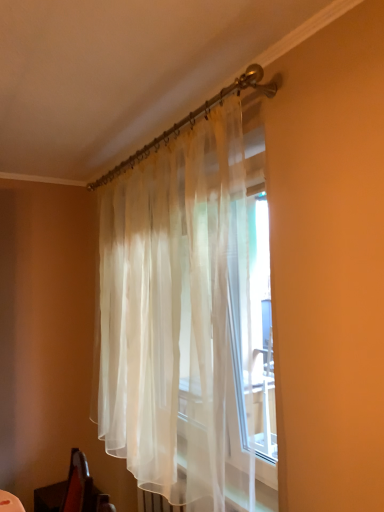
Question: From a real-world perspective, is translucent white curtain at upper center above or below wooden swivel chair at lower left?

Choices:
 (A) above
 (B) below

Answer: (A)

Question: Would you say translucent white curtain at upper center is to the left or to the right of wooden swivel chair at lower left in the picture?

Choices:
 (A) right
 (B) left

Answer: (A)

Question: From the image's perspective, is translucent white curtain at upper center above or below wooden swivel chair at lower left?

Choices:
 (A) above
 (B) below

Answer: (A)

Question: From a real-world perspective, is wooden swivel chair at lower left positioned above or below translucent white curtain at upper center?

Choices:
 (A) below
 (B) above

Answer: (A)

Question: Is wooden swivel chair at lower left in front of or behind translucent white curtain at upper center in the image?

Choices:
 (A) front
 (B) behind

Answer: (B)

Question: From the image's perspective, is wooden swivel chair at lower left positioned above or below translucent white curtain at upper center?

Choices:
 (A) above
 (B) below

Answer: (B)

Question: Is wooden swivel chair at lower left situated inside translucent white curtain at upper center or outside?

Choices:
 (A) outside
 (B) inside

Answer: (A)